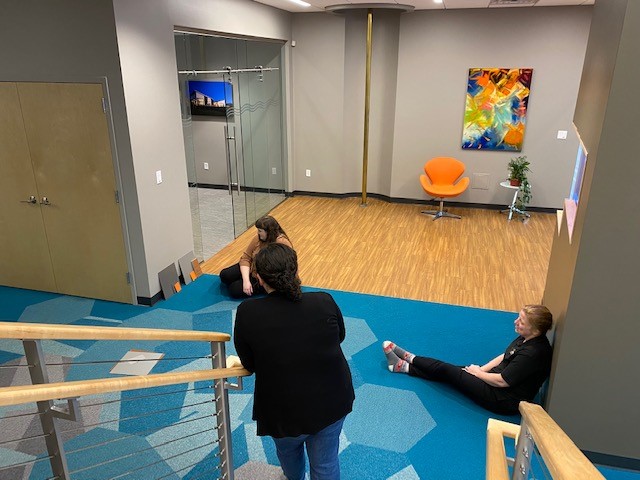
Locate an element on the screen. glass doors is located at coordinates (232, 142).